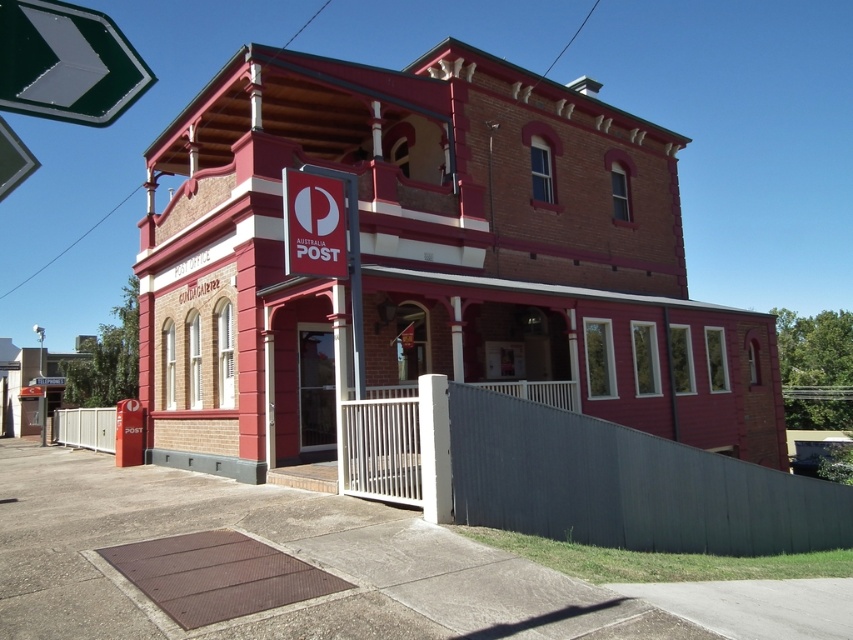
Question: Is matte red sign at center below white metal fence at lower left?

Choices:
 (A) no
 (B) yes

Answer: (A)

Question: Which point is closer to the camera?

Choices:
 (A) pos(328,221)
 (B) pos(0,99)
 (C) pos(836,497)

Answer: (B)

Question: Observing the image, what is the correct spatial positioning of metallic gray fence at center in reference to green reflective arrow at upper left?

Choices:
 (A) left
 (B) right

Answer: (B)

Question: Which point is closer to the camera taking this photo?

Choices:
 (A) (33, 54)
 (B) (297, 241)
 (C) (86, 419)
 (D) (793, 488)

Answer: (A)

Question: Is green reflective arrow at upper left to the left of white metal fence at lower left from the viewer's perspective?

Choices:
 (A) yes
 (B) no

Answer: (B)

Question: Which object is the closest to the green reflective arrow at upper left?

Choices:
 (A) white metal fence at lower left
 (B) metallic gray fence at center
 (C) matte red sign at center

Answer: (C)